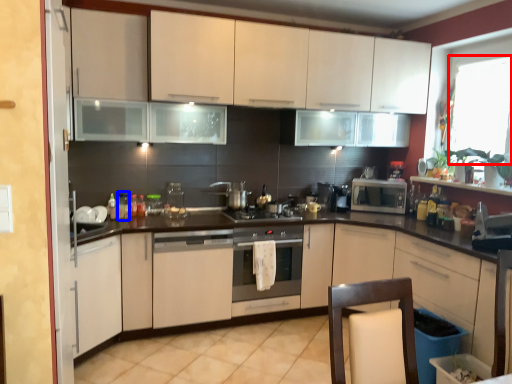
Question: Which object appears farthest to the camera in this image, window screen (highlighted by a red box) or bottle (highlighted by a blue box)?

Choices:
 (A) window screen
 (B) bottle

Answer: (B)